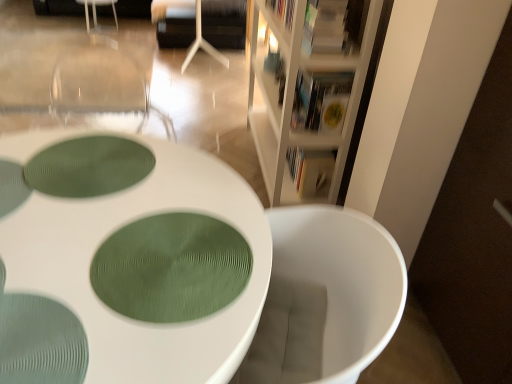
Find the location of `vacant area that lies between green textured placemat at center, the second oval when ordered from front to back, and green textured oval at center, which ranks as the second oval in top-to-bottom order`. vacant area that lies between green textured placemat at center, the second oval when ordered from front to back, and green textured oval at center, which ranks as the second oval in top-to-bottom order is located at coordinates (135, 204).